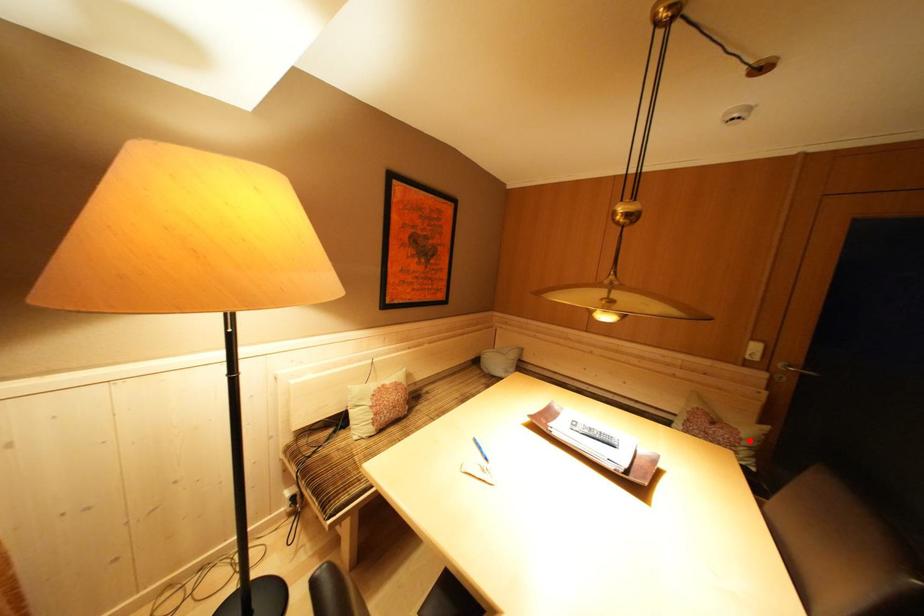
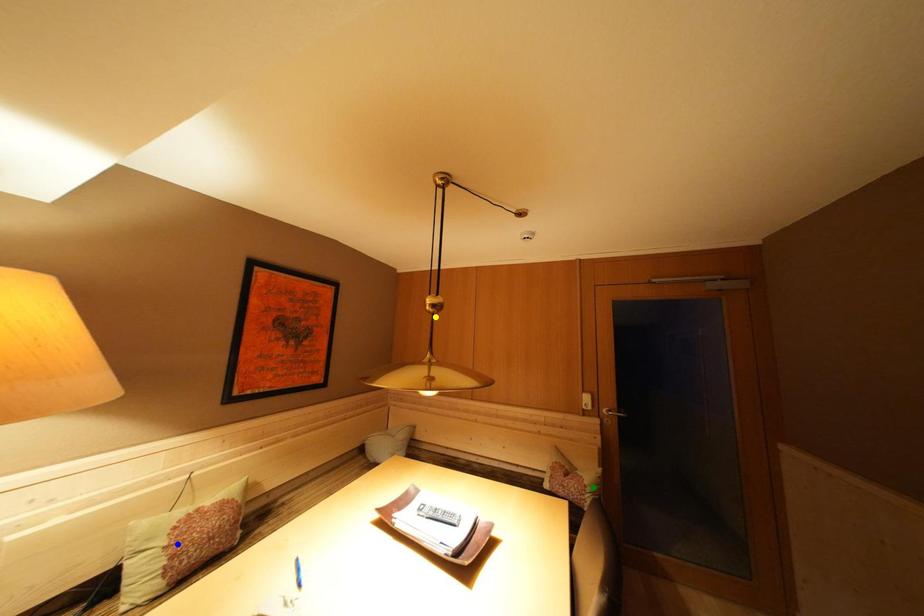
Question: I am providing you with two images of the same scene from different viewpoints. A red point is marked on the first image. You are given multiple points on the second image. Which point in image 2 is actually the same real-world point as the red point in image 1?

Choices:
 (A) blue point
 (B) yellow point
 (C) green point

Answer: (C)